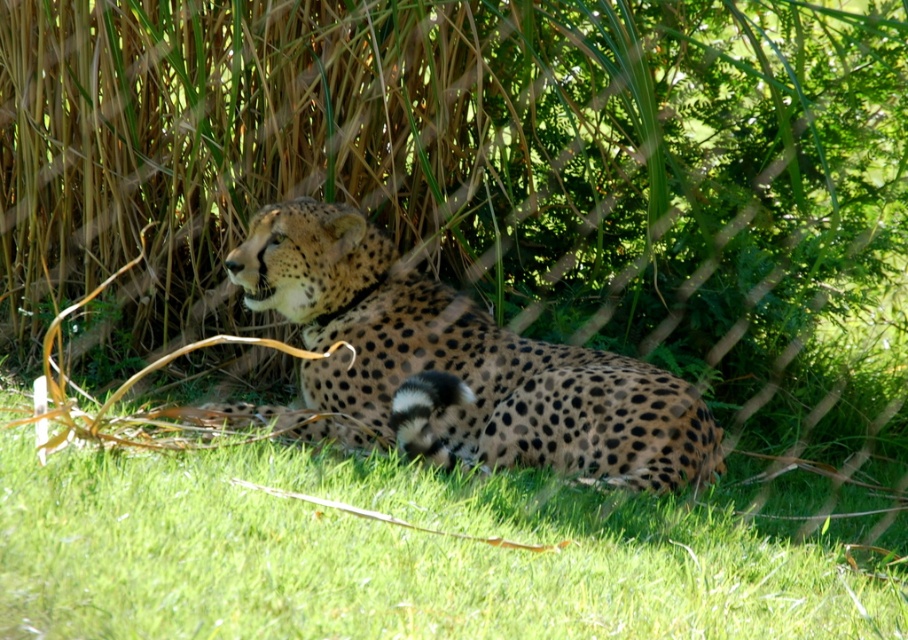
Question: Can you confirm if green grass at lower center is smaller than spotted fur cheetah at center?

Choices:
 (A) no
 (B) yes

Answer: (A)

Question: Does green grass at lower center lie behind spotted fur cheetah at center?

Choices:
 (A) no
 (B) yes

Answer: (A)

Question: Is green grass at lower center smaller than spotted fur cheetah at center?

Choices:
 (A) yes
 (B) no

Answer: (B)

Question: Which of the following is the farthest from the observer?

Choices:
 (A) spotted fur cheetah at center
 (B) green grass at lower center

Answer: (A)